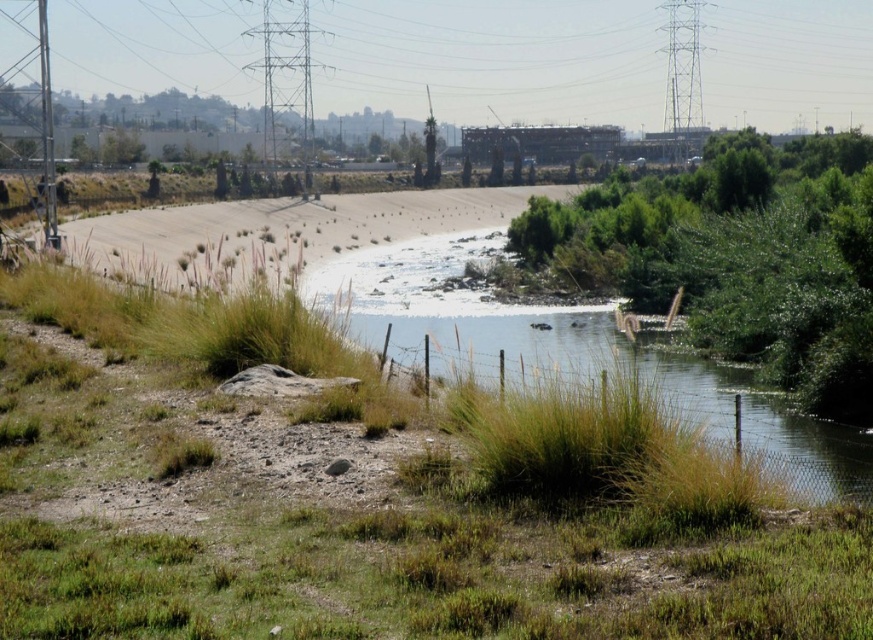
This screenshot has height=640, width=873. What do you see at coordinates (376, 499) in the screenshot? I see `green grass at center` at bounding box center [376, 499].

Is green grass at center taller than green grassy river at center?

No, green grass at center is not taller than green grassy river at center.

Between point (555, 608) and point (729, 406), which one is positioned behind?

Point (729, 406)

Identify the location of green grass at center. (376, 499).